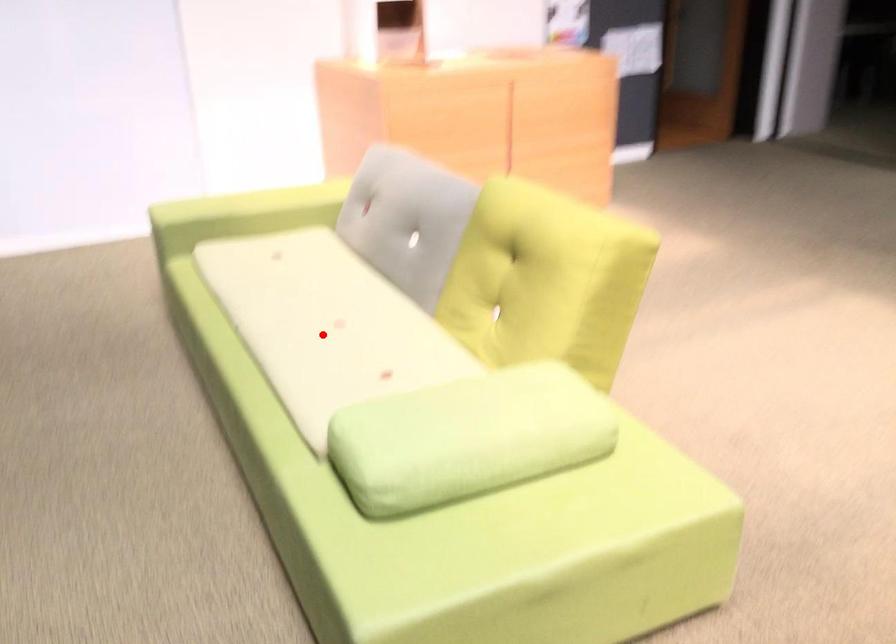
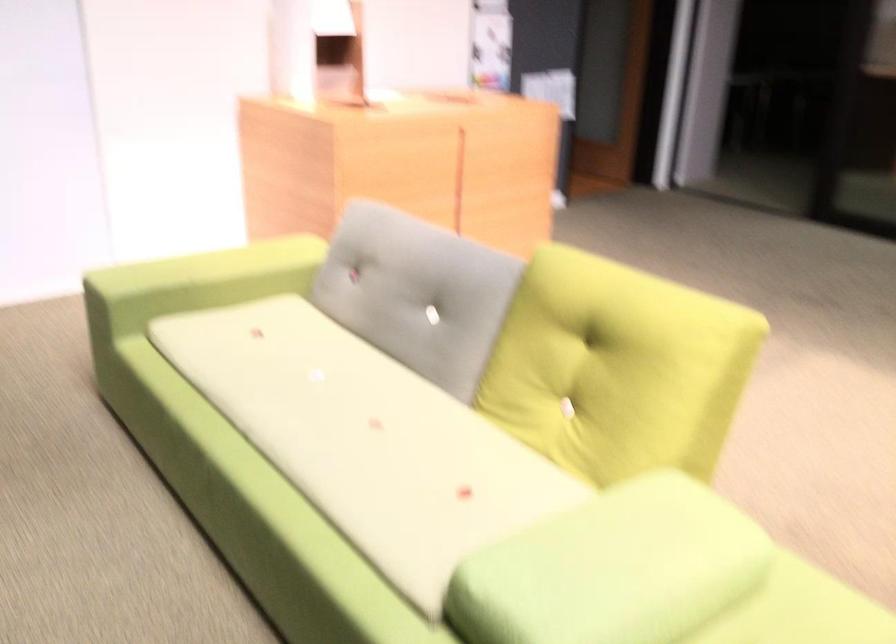
Question: I am providing you with two images of the same scene from different viewpoints. A red point is shown in image1. For the corresponding object point in image2, is it positioned nearer or farther from the camera?

Choices:
 (A) Nearer
 (B) Farther

Answer: (A)